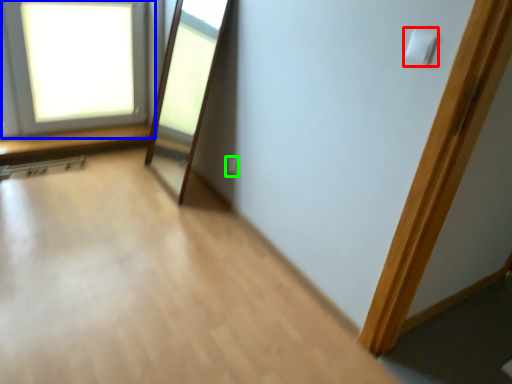
Question: Based on their relative distances, which object is nearer to light switch (highlighted by a red box)? Choose from window (highlighted by a blue box) and electric outlet (highlighted by a green box).

Choices:
 (A) window
 (B) electric outlet

Answer: (B)